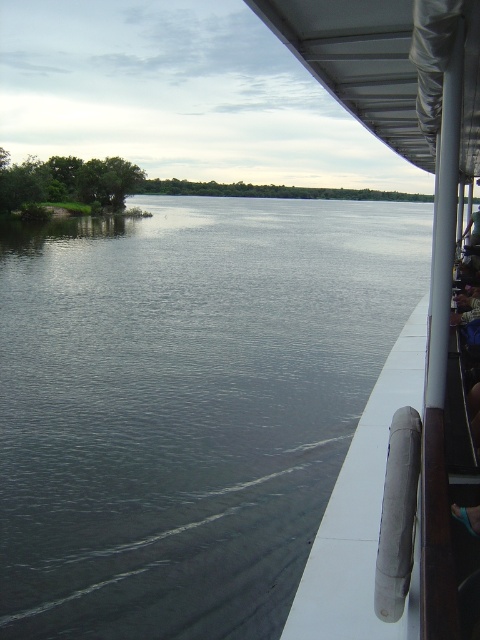
You are standing on the boat deck and want to throw a rope to a point that is closer to you. Which point would you choose between point (219, 323) and point (444, 193)?

Point (219, 323) is further to the viewer than point (444, 193). Therefore, you should choose point (444, 193) because it is closer to you.

You are standing on the boat deck and want to move to the left side. Which object will you pass first, the gray smooth water at center or the white rubber handrail at right?

You will pass the white rubber handrail at right first because it is located to the right of the gray smooth water at center, so when moving left from the deck, you encounter the handrail before reaching the water.